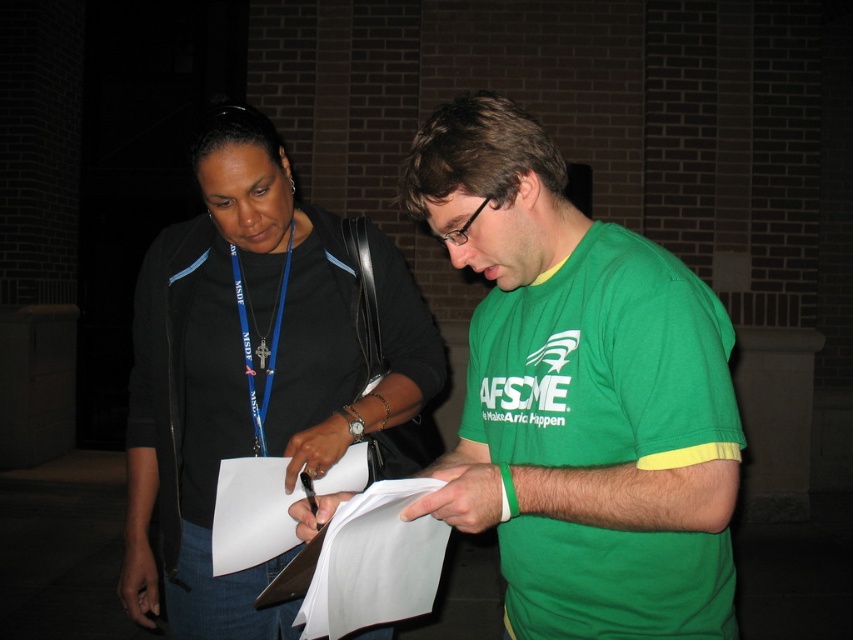
You are a photographer trying to capture a clear shot of the text on the blue fabric lanyard at center and the white paper at center. Since both are in focus, you need to ensure they are in the same focal plane. Based on their positions, will you need to adjust the camera angle to keep both in focus?

The white paper at center is below the blue fabric lanyard at center. To keep both in focus, you might need to adjust the camera angle so that the focal plane aligns with both objects, as they are at different vertical positions.

You are a photographer setting up a camera to capture the scene described. You need to ensure that both the green fabric shirt at center and the blue fabric lanyard at center are clearly visible in the frame. Based on their relative sizes in the image, which object should you focus on first to ensure proper focus, and why?

The green fabric shirt at center is taller than the blue fabric lanyard at center, so you should focus on the green fabric shirt at center first since it is larger and will require more precise focusing to ensure clarity.